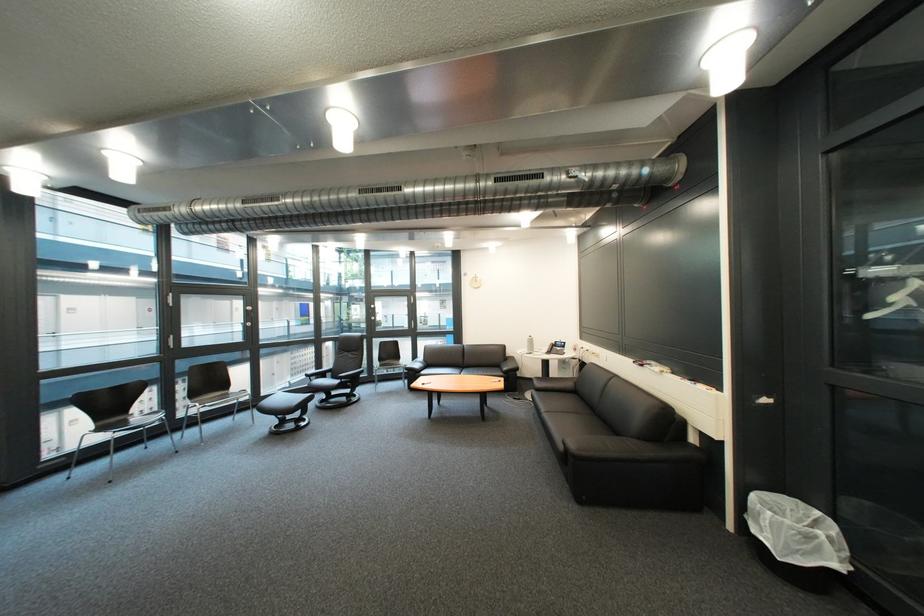
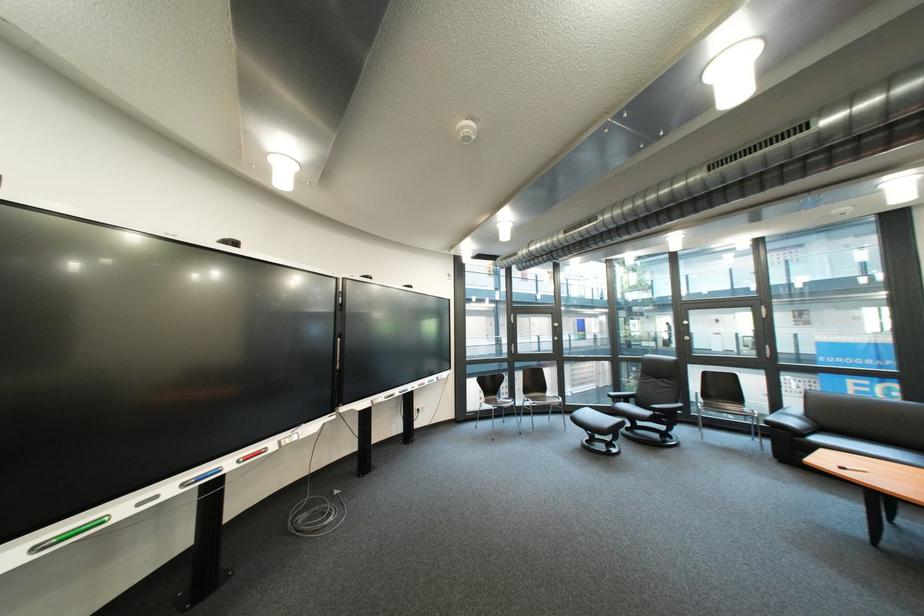
The point at (160,450) is marked in the first image. Where is the corresponding point in the second image?

(517, 424)